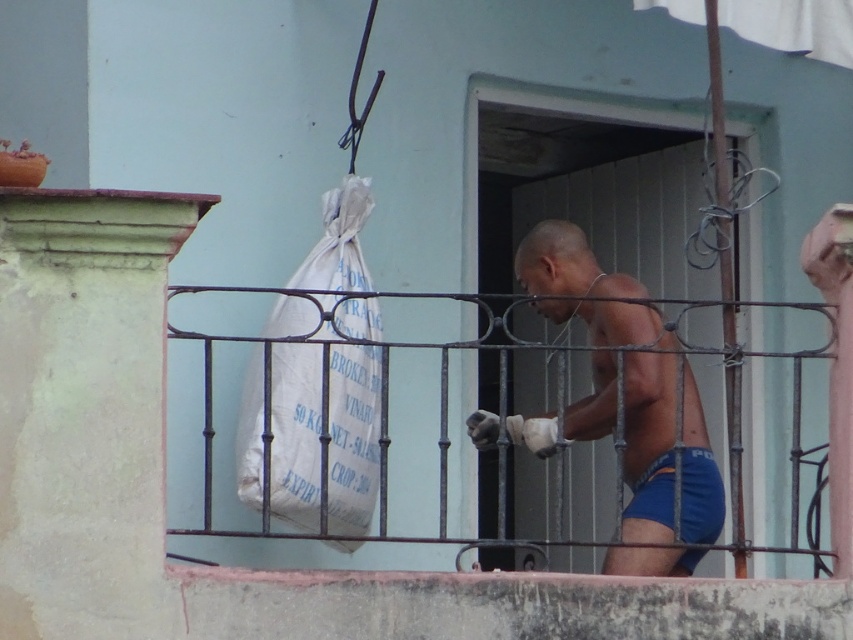
You are a safety inspector observing the scene. You notice the blue fabric shorts at center and the white fabric sack at center. Which object is positioned closer to your viewpoint?

The blue fabric shorts at center are closer to the viewer than the white fabric sack at center.

You are a safety inspector observing the balcony scene. You notice the blue fabric shorts at center and the rusty metal cage at center. According to safety protocols, which object should be positioned higher to prevent falling hazards?

The rusty metal cage at center should be positioned higher than the blue fabric shorts at center to prevent falling hazards, as the blue fabric shorts at center is currently located below the rusty metal cage at center.

Based on the scene description, if you were to compare the blue fabric shorts at center and the white fabric sack at center, which one is shorter in height?

The blue fabric shorts at center is shorter in height compared to the white fabric sack at center.